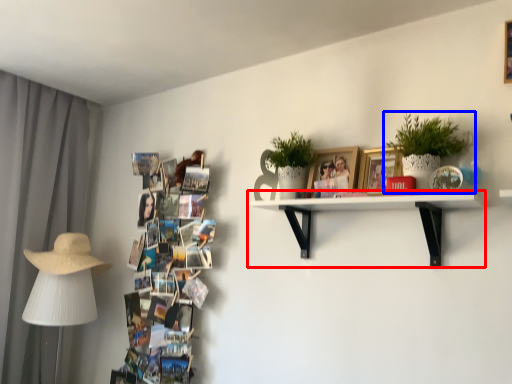
Question: Which object is closer to the camera taking this photo, shelf (highlighted by a red box) or houseplant (highlighted by a blue box)?

Choices:
 (A) shelf
 (B) houseplant

Answer: (A)